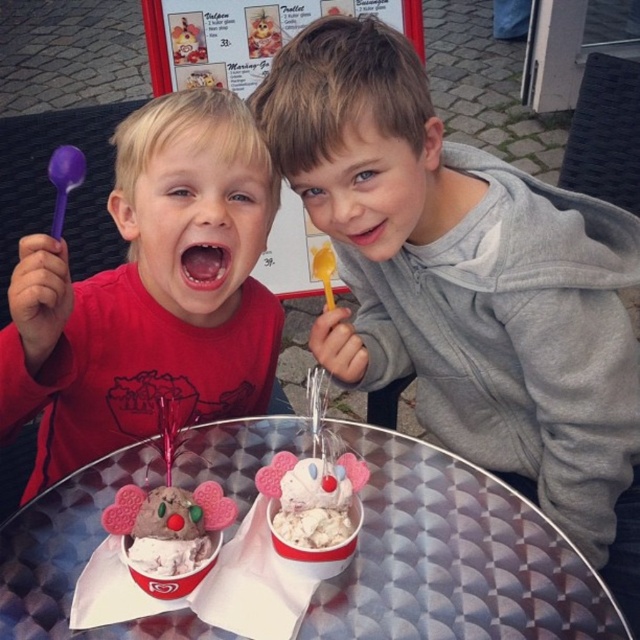
Question: Which point appears closest to the camera in this image?

Choices:
 (A) (227, 205)
 (B) (145, 467)

Answer: (A)

Question: Can you confirm if matte red shirt at left is positioned to the left of metallic silver table at center?

Choices:
 (A) no
 (B) yes

Answer: (B)

Question: Is matte red shirt at left to the right of metallic silver table at center from the viewer's perspective?

Choices:
 (A) yes
 (B) no

Answer: (B)

Question: Is matte red shirt at left thinner than metallic silver table at center?

Choices:
 (A) no
 (B) yes

Answer: (B)